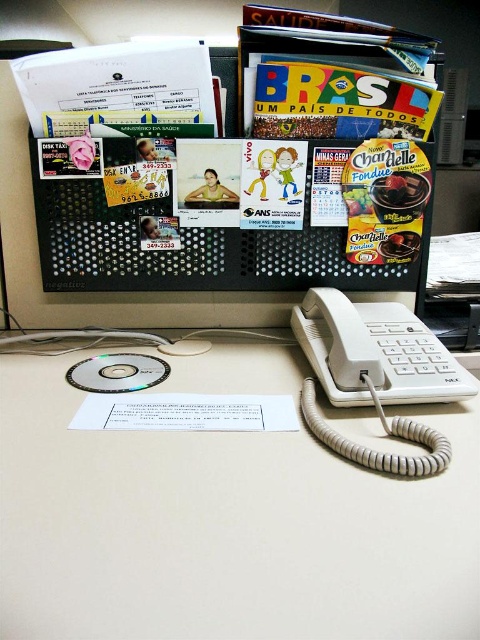
Question: Which object is the closest to the white plastic phone at center?

Choices:
 (A) transparent plastic cd at center
 (B) white plastic desk at center

Answer: (B)

Question: Which of the following is the closest to the observer?

Choices:
 (A) white plastic phone at center
 (B) transparent plastic cd at center

Answer: (A)

Question: Is white plastic desk at center to the right of transparent plastic cd at center from the viewer's perspective?

Choices:
 (A) no
 (B) yes

Answer: (B)

Question: From the image, what is the correct spatial relationship of white plastic desk at center in relation to white plastic phone at center?

Choices:
 (A) above
 (B) below

Answer: (B)

Question: Is white plastic desk at center below transparent plastic cd at center?

Choices:
 (A) no
 (B) yes

Answer: (B)

Question: Estimate the real-world distances between objects in this image. Which object is closer to the transparent plastic cd at center?

Choices:
 (A) white plastic phone at center
 (B) white plastic desk at center

Answer: (B)